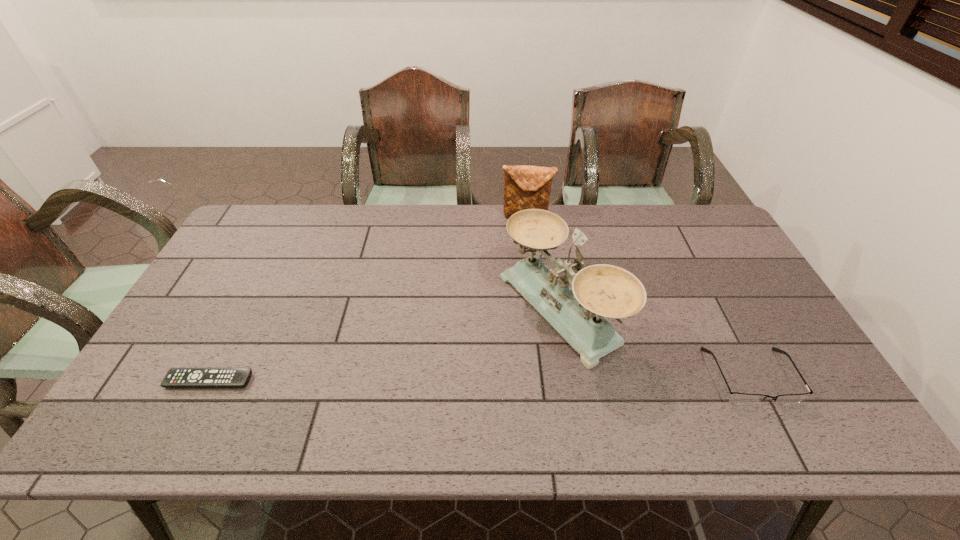
The width and height of the screenshot is (960, 540). Find the location of `free space located on the open side of the second tallest object`. free space located on the open side of the second tallest object is located at coordinates (518, 240).

The width and height of the screenshot is (960, 540). I want to click on free space located on the front-facing side of the tallest object, so click(x=449, y=373).

Find the location of `free region located 0.330m on the front-facing side of the tallest object`. free region located 0.330m on the front-facing side of the tallest object is located at coordinates (398, 400).

Find the location of a particular element. free space located 0.140m on the front-facing side of the tallest object is located at coordinates tap(467, 364).

The width and height of the screenshot is (960, 540). In order to click on object that is at the far edge in this screenshot , I will do `click(525, 187)`.

In order to click on remote control present at the near edge in this screenshot , I will do `click(176, 377)`.

Locate an element on the screen. The image size is (960, 540). spectacles at the near edge is located at coordinates (737, 398).

You are a GUI agent. You are given a task and a screenshot of the screen. Output one action in this format:
    pyautogui.click(x=<x>, y=<y>)
    Task: Click on the object located at the left edge
    The height and width of the screenshot is (540, 960).
    Given the screenshot: What is the action you would take?
    pyautogui.click(x=176, y=377)

Image resolution: width=960 pixels, height=540 pixels. In order to click on object positioned at the right edge in this screenshot , I will do `click(737, 398)`.

This screenshot has width=960, height=540. What are the coordinates of `object that is positioned at the near left corner` in the screenshot? It's located at (176, 377).